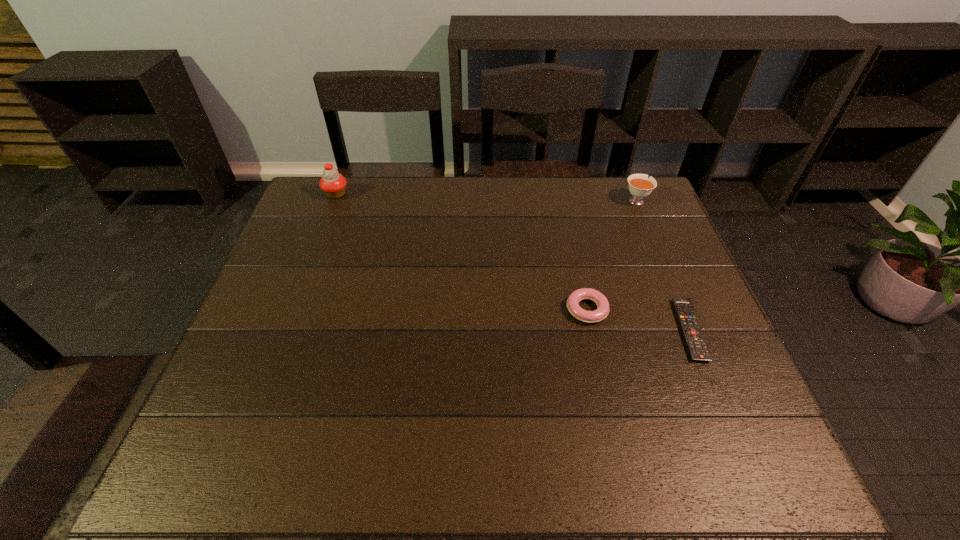
I want to click on free point between the third object from right to left and the third shortest object, so click(x=612, y=255).

Where is `empty location between the doughnut and the cupcake`? The height and width of the screenshot is (540, 960). empty location between the doughnut and the cupcake is located at coordinates (462, 252).

In order to click on free space between the second object from left to right and the teacup in this screenshot , I will do `click(612, 255)`.

Find the location of a particular element. This screenshot has width=960, height=540. free space between the tallest object and the third tallest object is located at coordinates (462, 252).

Where is `free spot between the third shortest object and the shortest object`? free spot between the third shortest object and the shortest object is located at coordinates (662, 265).

I want to click on object identified as the second closest to the cupcake, so click(x=640, y=186).

Where is `object that is the third nearest to the shortest object`? object that is the third nearest to the shortest object is located at coordinates (333, 184).